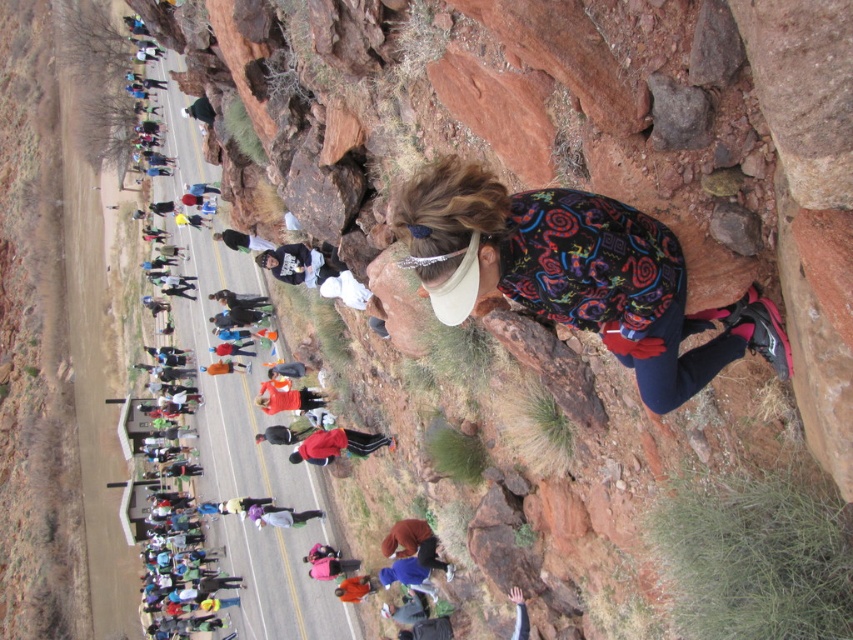
You are a participant in a race and you see the multicolored fabric at upper right and the smooth dirt road at center. Which object is lower in height?

The multicolored fabric at upper right has a lesser height compared to the smooth dirt road at center, so the multicolored fabric at upper right is lower in height.